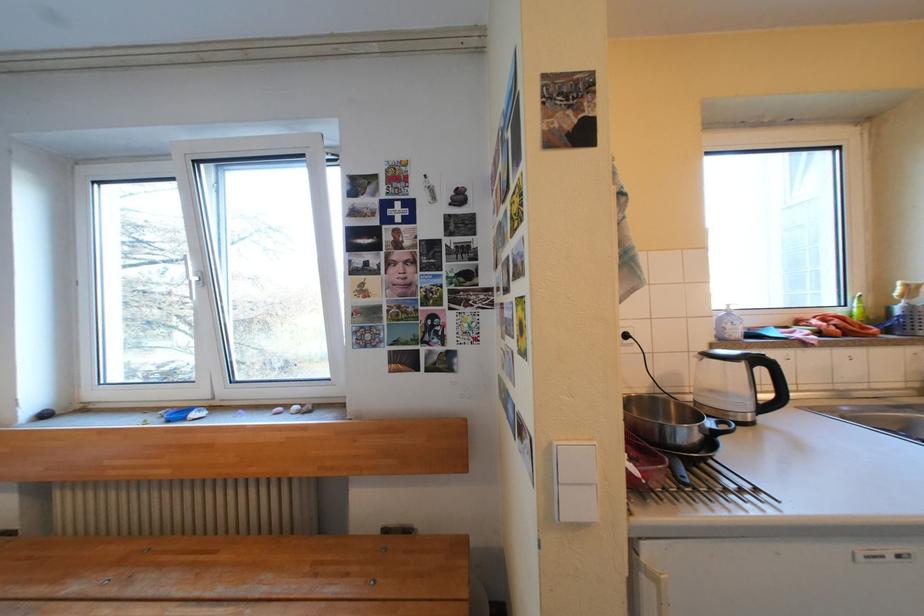
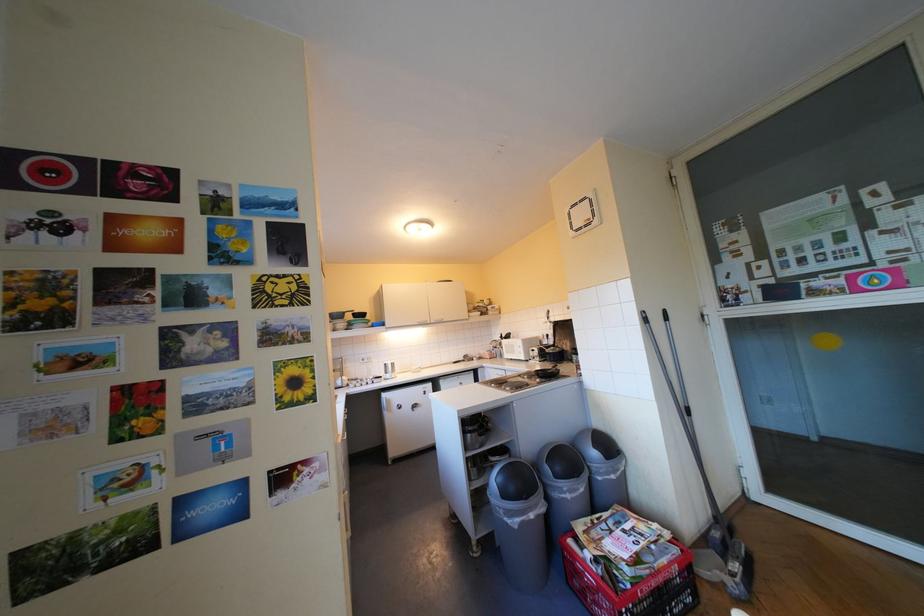
Question: How did the camera likely rotate?

Choices:
 (A) Left
 (B) Right
 (C) Up
 (D) Down

Answer: (B)